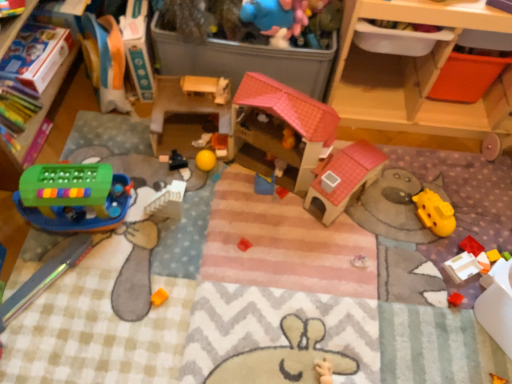
Find the location of a particular element. vacant area that is in front of wooden dollhouse at center, which is counted as the seventh toy, starting from the right is located at coordinates (192, 186).